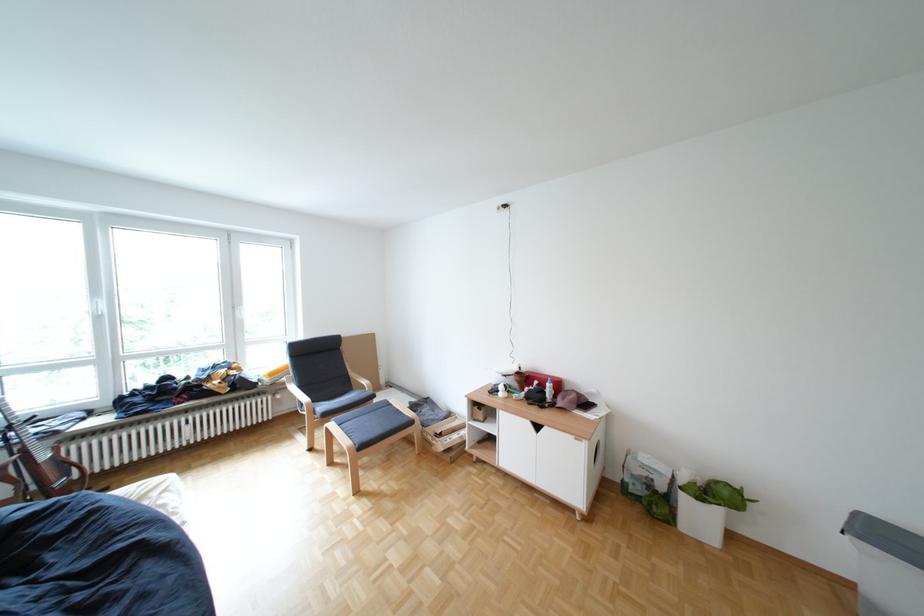
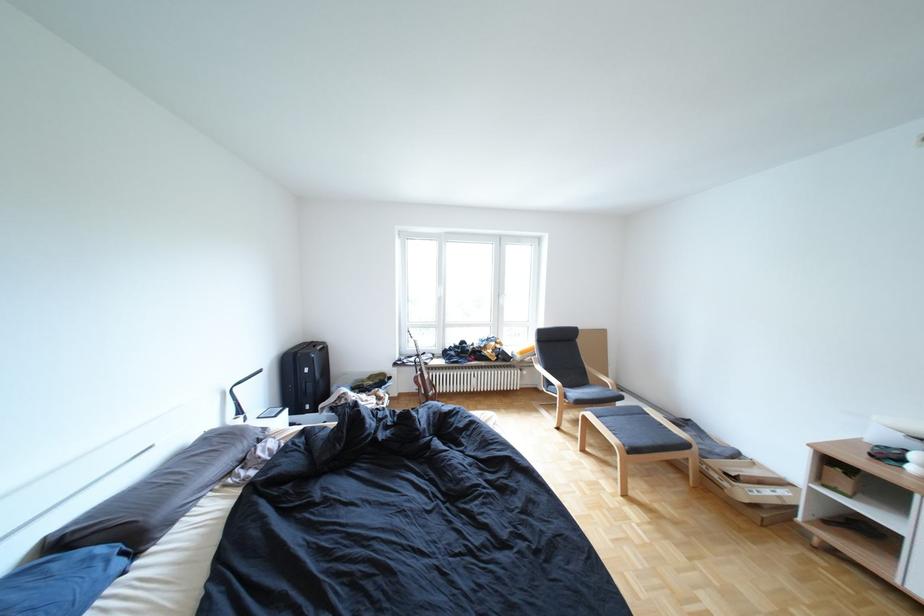
Question: The camera is either moving clockwise (left) or counter-clockwise (right) around the object. The first image is from the beginning of the video and the second image is from the end. Is the camera moving left or right when shooting the video?

Choices:
 (A) Left
 (B) Right

Answer: (B)